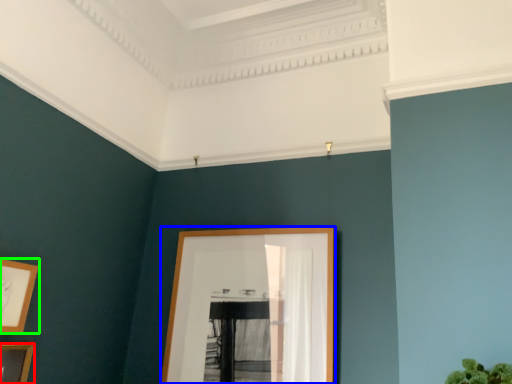
Question: Estimate the real-world distances between objects in this image. Which object is farther from picture frame (highlighted by a red box), picture frame (highlighted by a blue box) or picture frame (highlighted by a green box)?

Choices:
 (A) picture frame
 (B) picture frame

Answer: (A)